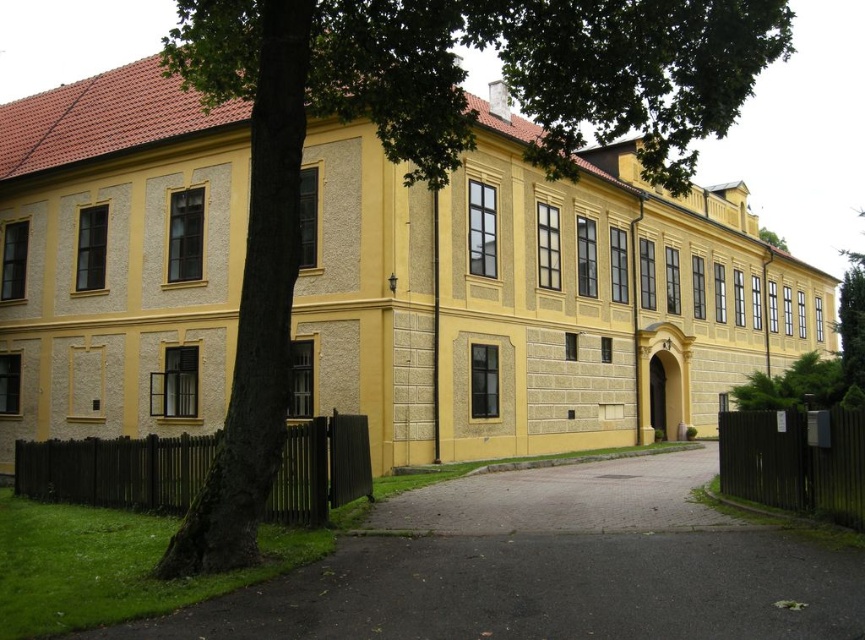
You are standing at the entrance of the two story building with a yellow facade and want to take a photo of the building without the green leafy tree at center blocking the view. Based on the coordinates given, where should you move to in order to avoid the tree?

The green leafy tree at center is located at coordinates point (427,147). To avoid the tree, move to a position where the tree is not in the frame, such as to the right side of the building or further back to get a wider angle that excludes the tree.

You are standing at the point marked with coordinates point (427, 147) in the image. What object is directly in front of you?

The point (427, 147) corresponds to the green leafy tree at center, so the object directly in front of you is the green leafy tree at center.

You are standing in front of the two story building with a yellow facade. You see a green leafy tree at center and a black asphalt driveway at lower center. Which object is taller?

The green leafy tree at center is taller than the black asphalt driveway at lower center.